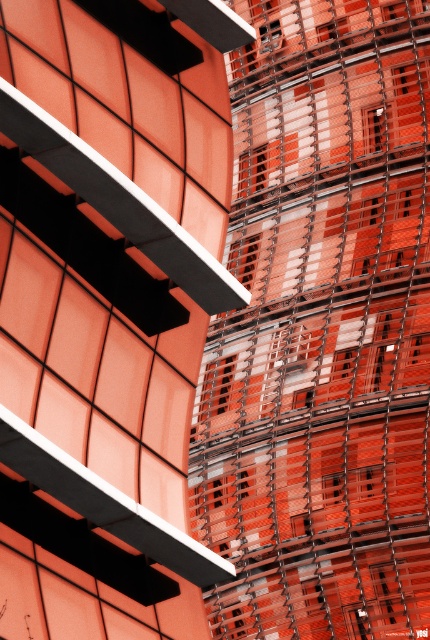
Can you confirm if metallic grid tower at center is taller than metallic grid at center?

No, metallic grid tower at center is not taller than metallic grid at center.

Is point (208, 269) positioned after point (424, 500)?

No, it is in front of (424, 500).

Is point (80, 346) positioned behind point (269, 282)?

No, it is not.

At what (x,y) coordinates should I click in order to perform the action: click on metallic grid tower at center. Please return your answer as a coordinate pair (x, y). This screenshot has height=640, width=430. Looking at the image, I should click on pos(107,307).